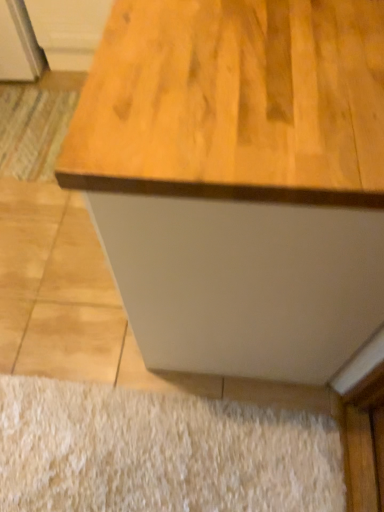
The image size is (384, 512). What are the coordinates of `vacant region above striped fabric doormat at lower left, which ranks as the first doormat in left-to-right order (from a real-world perspective)` in the screenshot? It's located at (33, 128).